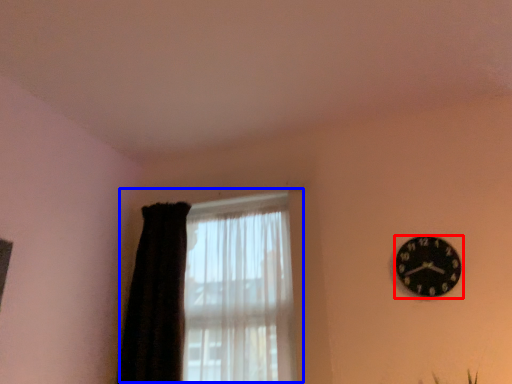
Question: Which point is closer to the camera, wall clock (highlighted by a red box) or window (highlighted by a blue box)?

Choices:
 (A) wall clock
 (B) window

Answer: (A)